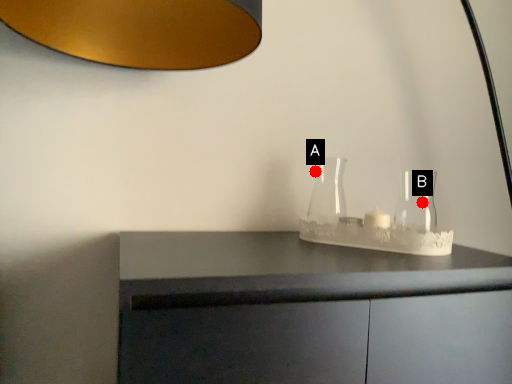
Question: Two points are circled on the image, labeled by A and B beside each circle. Which point is farther from the camera taking this photo?

Choices:
 (A) A is further
 (B) B is further

Answer: (A)